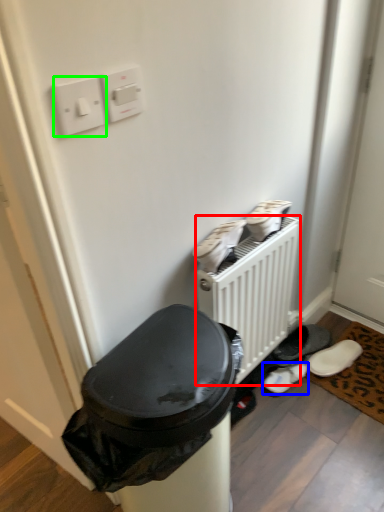
Question: Based on their relative distances, which object is farther from radiator (highlighted by a red box)? Choose from footwear (highlighted by a blue box) and light switch (highlighted by a green box).

Choices:
 (A) footwear
 (B) light switch

Answer: (B)